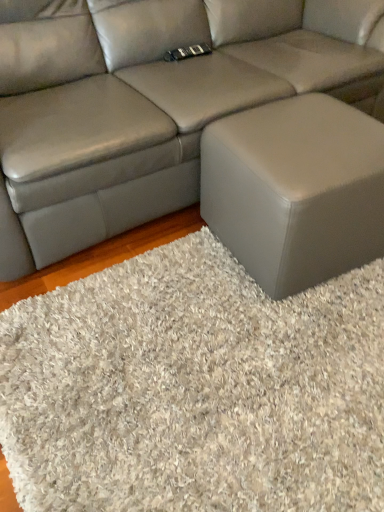
Question: From the image's perspective, would you say matte gray leather couch at center is positioned over matte gray ottoman at lower right?

Choices:
 (A) yes
 (B) no

Answer: (A)

Question: Considering the relative sizes of matte gray leather couch at center and matte gray ottoman at lower right in the image provided, is matte gray leather couch at center smaller than matte gray ottoman at lower right?

Choices:
 (A) no
 (B) yes

Answer: (A)

Question: Is matte gray ottoman at lower right located within matte gray leather couch at center?

Choices:
 (A) no
 (B) yes

Answer: (A)

Question: Considering the relative positions of matte gray leather couch at center and matte gray ottoman at lower right in the image provided, is matte gray leather couch at center behind matte gray ottoman at lower right?

Choices:
 (A) no
 (B) yes

Answer: (A)

Question: Is matte gray leather couch at center facing towards matte gray ottoman at lower right?

Choices:
 (A) yes
 (B) no

Answer: (A)

Question: From the image's perspective, is matte gray leather couch at center above or below matte gray ottoman at lower right?

Choices:
 (A) below
 (B) above

Answer: (B)

Question: Looking at their shapes, would you say matte gray leather couch at center is wider or thinner than matte gray ottoman at lower right?

Choices:
 (A) wide
 (B) thin

Answer: (A)

Question: Does point (97, 176) appear closer or farther from the camera than point (297, 143)?

Choices:
 (A) farther
 (B) closer

Answer: (A)

Question: In terms of height, does matte gray leather couch at center look taller or shorter compared to matte gray ottoman at lower right?

Choices:
 (A) tall
 (B) short

Answer: (A)

Question: Considering the positions of white shaggy rug at lower right and matte gray ottoman at lower right in the image, is white shaggy rug at lower right bigger or smaller than matte gray ottoman at lower right?

Choices:
 (A) small
 (B) big

Answer: (A)

Question: From a real-world perspective, relative to matte gray ottoman at lower right, is white shaggy rug at lower right vertically above or below?

Choices:
 (A) below
 (B) above

Answer: (A)

Question: In the image, is white shaggy rug at lower right positioned in front of or behind matte gray ottoman at lower right?

Choices:
 (A) behind
 (B) front

Answer: (B)

Question: In terms of height, does white shaggy rug at lower right look taller or shorter compared to matte gray ottoman at lower right?

Choices:
 (A) tall
 (B) short

Answer: (B)

Question: Considering the positions of point (213, 172) and point (372, 456), is point (213, 172) closer or farther from the camera than point (372, 456)?

Choices:
 (A) closer
 (B) farther

Answer: (B)

Question: Relative to white shaggy rug at lower right, is matte gray ottoman at lower right in front or behind?

Choices:
 (A) behind
 (B) front

Answer: (A)